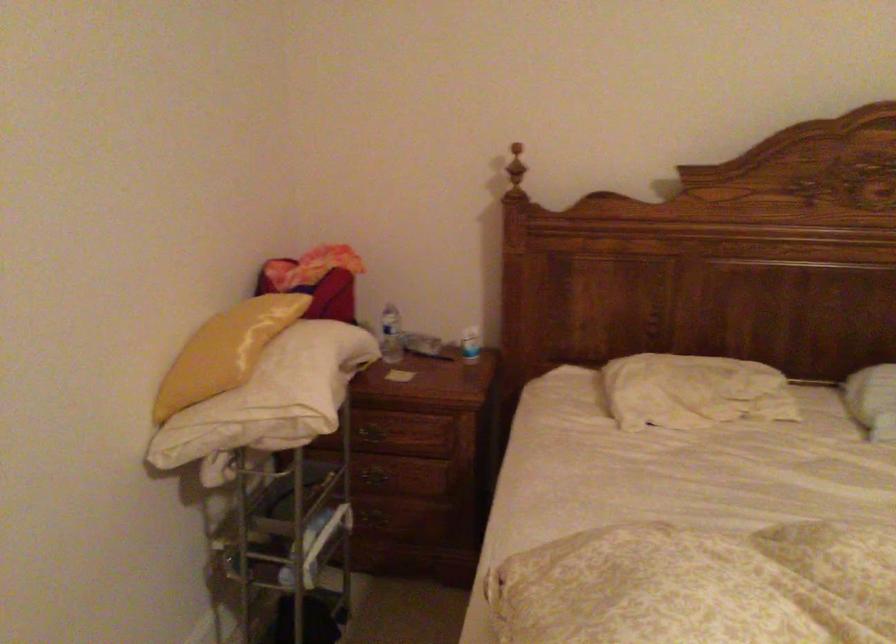
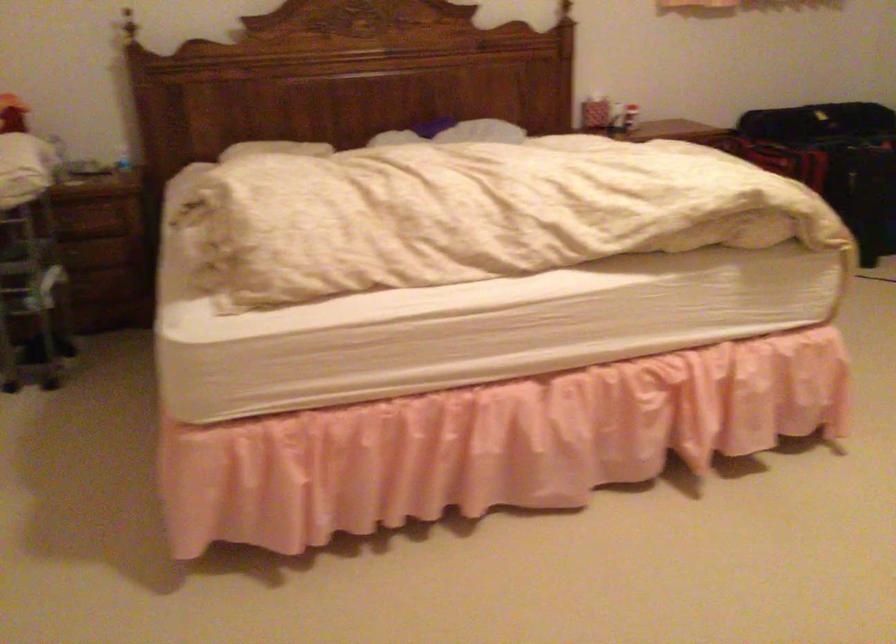
Question: What movement of the cameraman would produce the second image?

Choices:
 (A) Left
 (B) Right
 (C) Forward
 (D) Backward

Answer: (D)